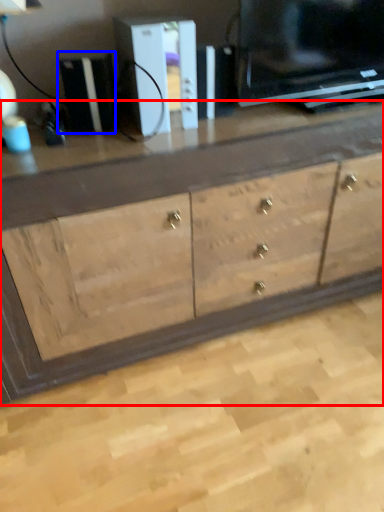
Question: Which object appears farthest to the camera in this image, chest of drawers (highlighted by a red box) or appliance (highlighted by a blue box)?

Choices:
 (A) chest of drawers
 (B) appliance

Answer: (B)